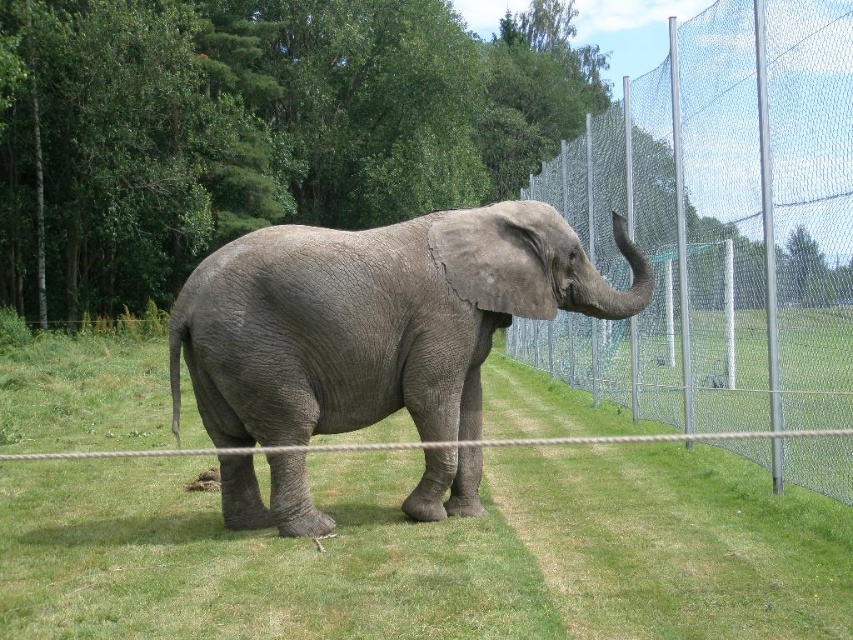
Question: Estimate the real-world distances between objects in this image. Which object is closer to the gray textured elephant at center?

Choices:
 (A) metal mesh fence at right
 (B) green grassy at center

Answer: (B)

Question: Which of the following is the closest to the observer?

Choices:
 (A) metal mesh fence at right
 (B) green grassy at center

Answer: (B)

Question: Which object is farther from the camera taking this photo?

Choices:
 (A) gray textured elephant at center
 (B) green grassy at center

Answer: (A)

Question: Can you confirm if metal mesh fence at right is positioned to the left of gray textured elephant at center?

Choices:
 (A) yes
 (B) no

Answer: (B)

Question: Can you confirm if green grassy at center is bigger than gray textured elephant at center?

Choices:
 (A) no
 (B) yes

Answer: (B)

Question: Does green grassy at center have a greater width compared to metal mesh fence at right?

Choices:
 (A) yes
 (B) no

Answer: (A)